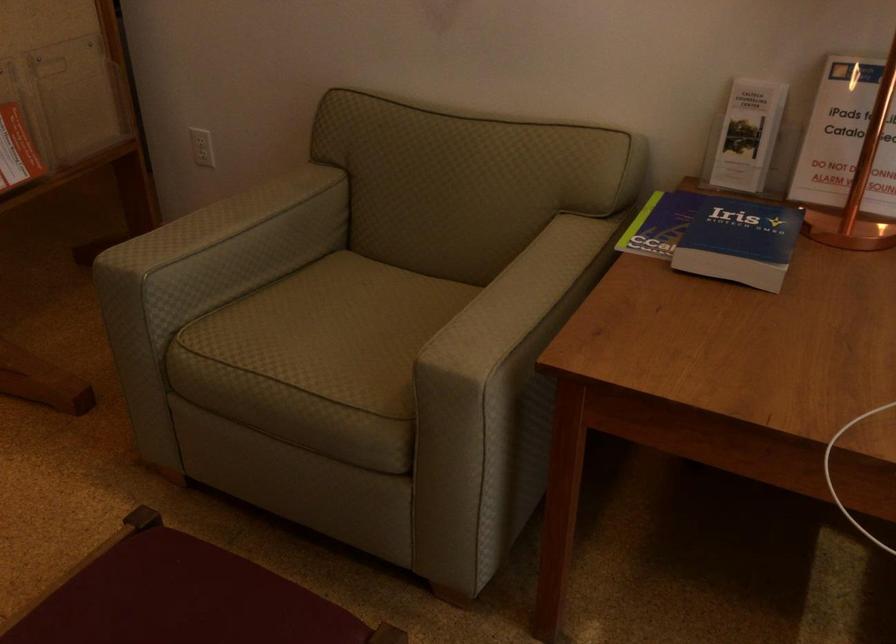
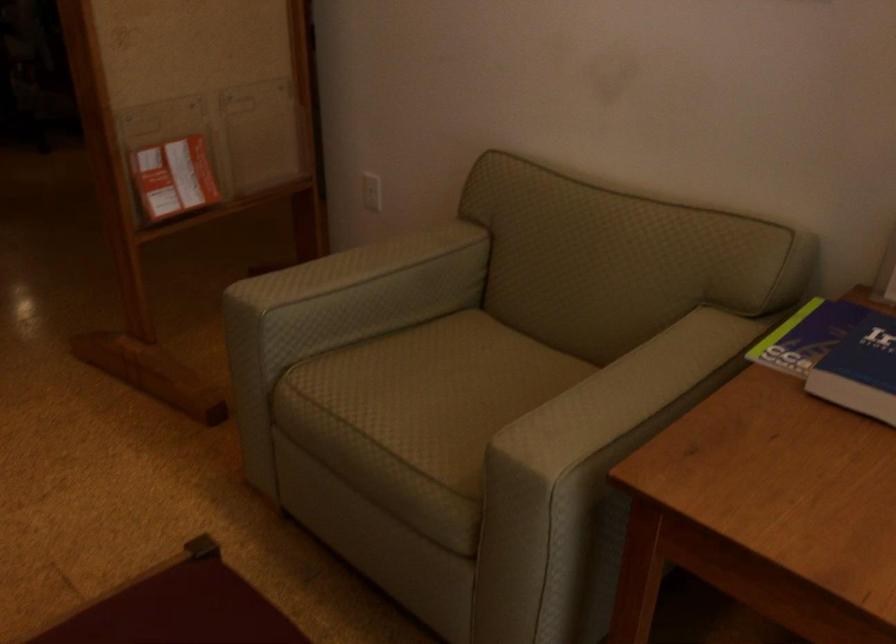
The images are taken continuously from a first-person perspective. In which direction are you moving?

The cameraman walked toward right, forward.